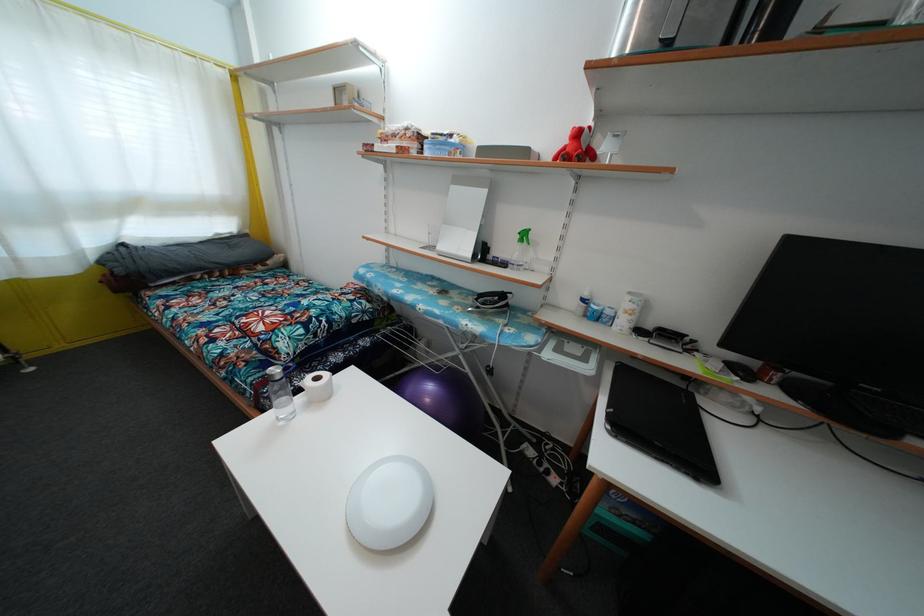
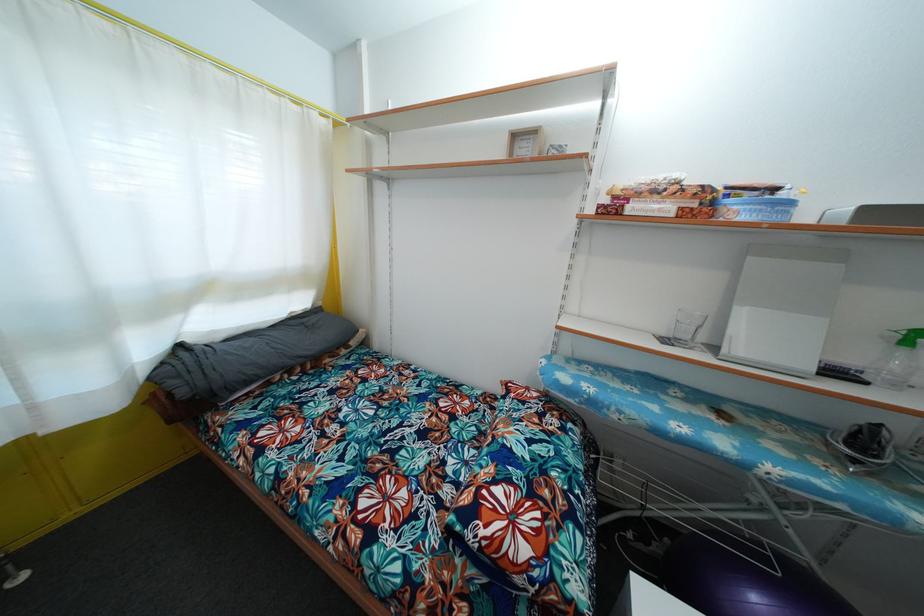
Find the pixel in the second image that matches the point at 123,278 in the first image.

(187, 399)